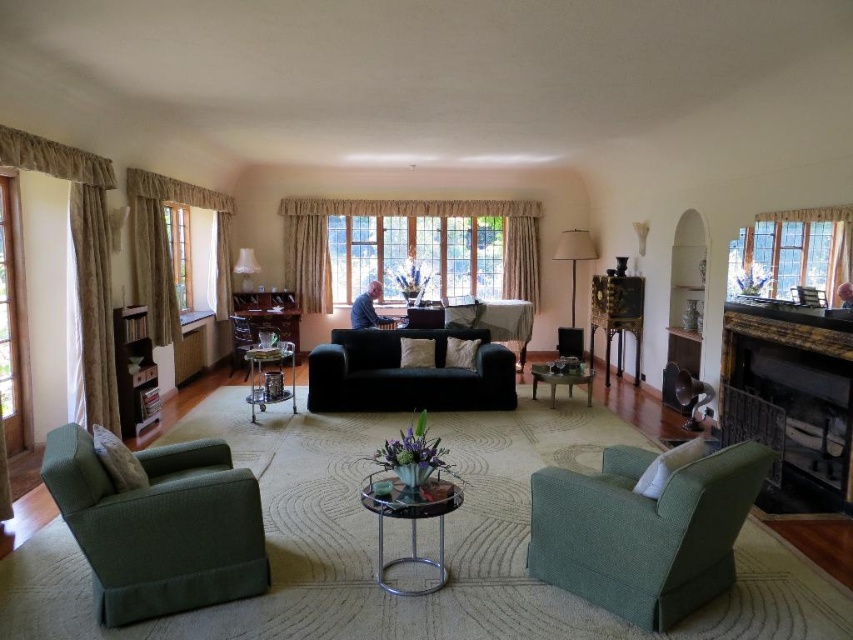
This screenshot has width=853, height=640. What do you see at coordinates (405, 374) in the screenshot?
I see `black fabric couch at center` at bounding box center [405, 374].

Describe the element at coordinates (405, 374) in the screenshot. This screenshot has width=853, height=640. I see `black fabric couch at center` at that location.

Find the location of a particular element. black fabric couch at center is located at coordinates (405, 374).

In the scene shown: Is the position of green fabric armchair at lower right more distant than that of clear glass window at center?

No.

Does point (701, 509) lie behind point (387, 269)?

No, it is not.

Identify the location of green fabric armchair at lower right. The height and width of the screenshot is (640, 853). (643, 531).

Identify the location of green fabric armchair at lower right. point(643,531).

Identify the location of green fabric armchair at lower left. Image resolution: width=853 pixels, height=640 pixels. (160, 525).

Who is lower down, green fabric armchair at lower left or clear glass coffee table at center?

Positioned lower is green fabric armchair at lower left.

This screenshot has height=640, width=853. In order to click on green fabric armchair at lower left in this screenshot , I will do `click(160, 525)`.

Image resolution: width=853 pixels, height=640 pixels. Identify the location of green fabric armchair at lower left. (160, 525).